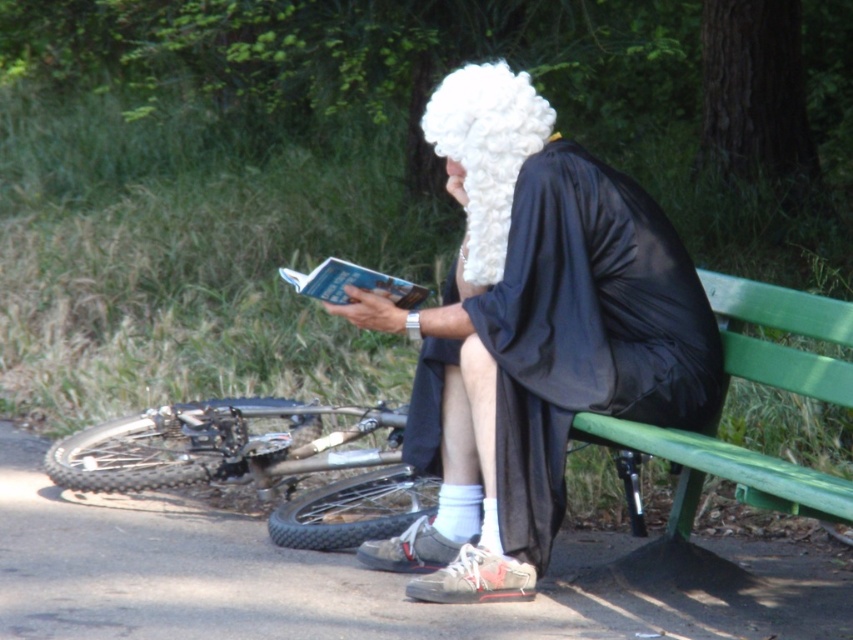
You are standing at the origin point of the coordinate system in the image. You want to walk to the green painted wood bench at lower right. What are the coordinates you need to move towards?

The coordinates to move towards are 0.739 in the x direction and 0.851 in the y direction.